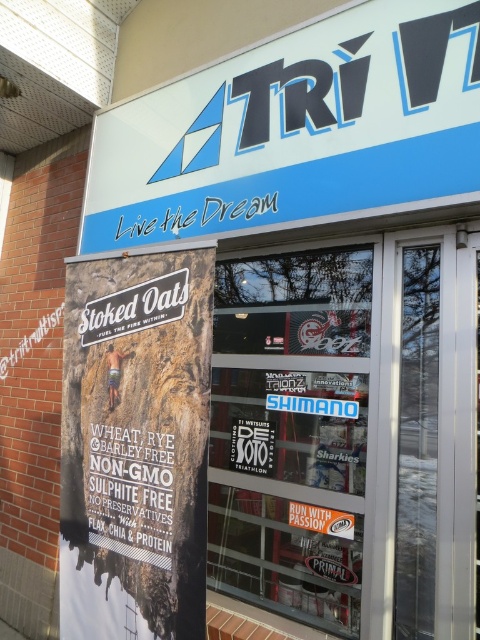
In the scene shown: Which of these two, blue plastic sign at upper center or matte paper poster at left, stands shorter?

blue plastic sign at upper center

Between blue plastic sign at upper center and matte paper poster at left, which one is positioned lower?

matte paper poster at left is lower down.

Identify the location of blue plastic sign at upper center. (296, 129).

Between point (131, 378) and point (245, 440), which one is positioned in front?

Point (131, 378) is more forward.

You are a GUI agent. You are given a task and a screenshot of the screen. Output one action in this format:
    pyautogui.click(x=<x>, y=<y>)
    Task: Click on the matte paper poster at left
    This screenshot has width=480, height=640.
    Given the screenshot: What is the action you would take?
    (x=135, y=445)

The image size is (480, 640). What are the coordinates of `matte paper poster at left` in the screenshot? It's located at (135, 445).

Identify the location of matte paper poster at left. Image resolution: width=480 pixels, height=640 pixels. (135, 445).

Can you confirm if blue plastic sign at upper center is positioned above matte black sign at center?

Indeed, blue plastic sign at upper center is positioned over matte black sign at center.

Is blue plastic sign at upper center positioned before matte black sign at center?

Yes, blue plastic sign at upper center is in front of matte black sign at center.

Where is `blue plastic sign at upper center`? Image resolution: width=480 pixels, height=640 pixels. blue plastic sign at upper center is located at coordinates (296, 129).

Where is `blue plastic sign at upper center`? Image resolution: width=480 pixels, height=640 pixels. blue plastic sign at upper center is located at coordinates (296, 129).